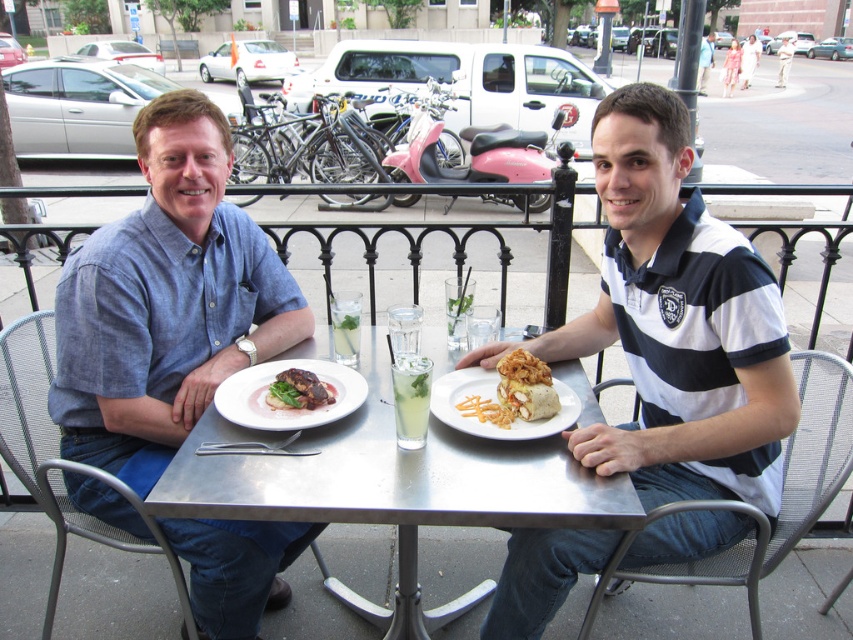
You are standing in front of the outdoor cafe table and want to place a small vase between the two points marked as point (642, 125) and point (170, 92). Which point should the vase be closer to in order to be nearer to the viewer?

The vase should be placed closer to point (642, 125) because it is closer to the viewer than point (170, 92).